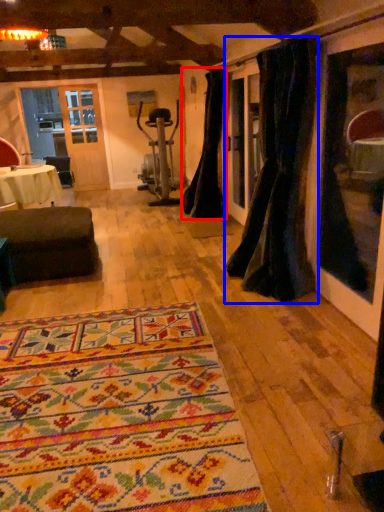
Question: Which of the following is the farthest to the observer, curtain (highlighted by a red box) or curtain (highlighted by a blue box)?

Choices:
 (A) curtain
 (B) curtain

Answer: (A)